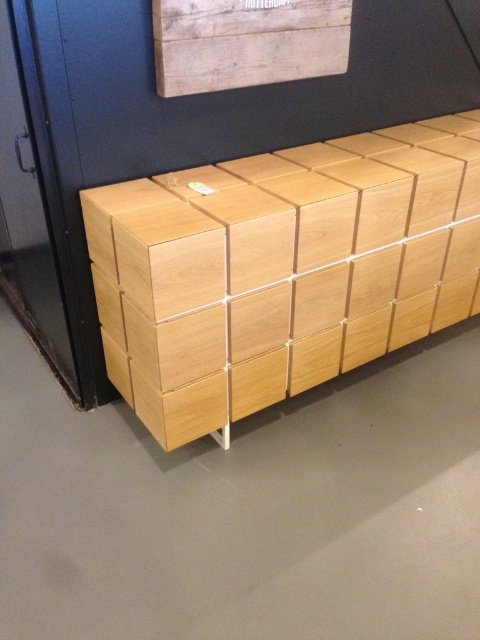
Question: Among these points, which one is nearest to the camera?

Choices:
 (A) (181, 365)
 (B) (287, 26)

Answer: (A)

Question: Does natural wood crate at center have a smaller size compared to wooden crate at upper center?

Choices:
 (A) yes
 (B) no

Answer: (B)

Question: Among these points, which one is farthest from the camera?

Choices:
 (A) (213, 84)
 (B) (151, 212)

Answer: (A)

Question: From the image, what is the correct spatial relationship of natural wood crate at center in relation to wooden crate at upper center?

Choices:
 (A) above
 (B) below

Answer: (B)

Question: Observing the image, what is the correct spatial positioning of natural wood crate at center in reference to wooden crate at upper center?

Choices:
 (A) left
 (B) right

Answer: (B)